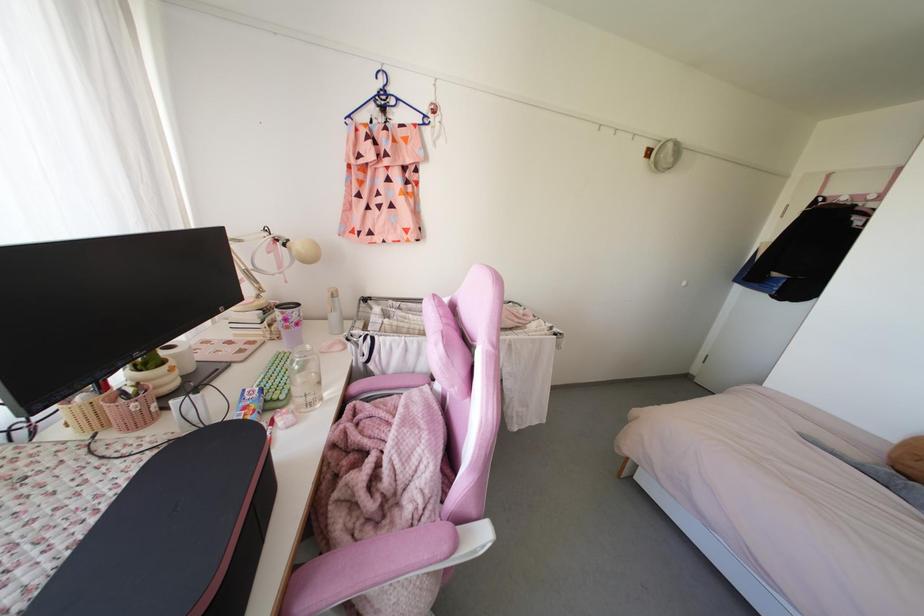
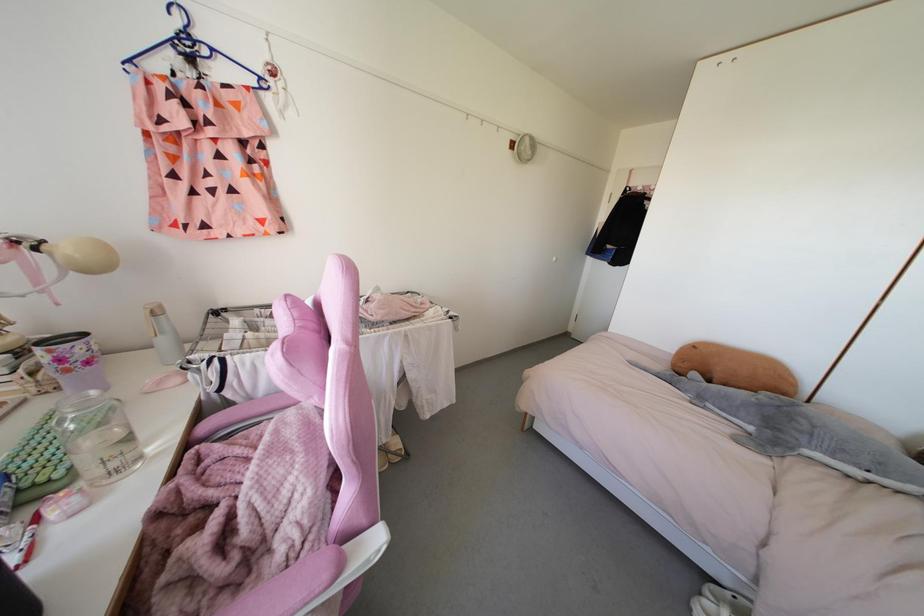
The point at (382,119) is marked in the first image. Where is the corresponding point in the second image?

(191, 73)